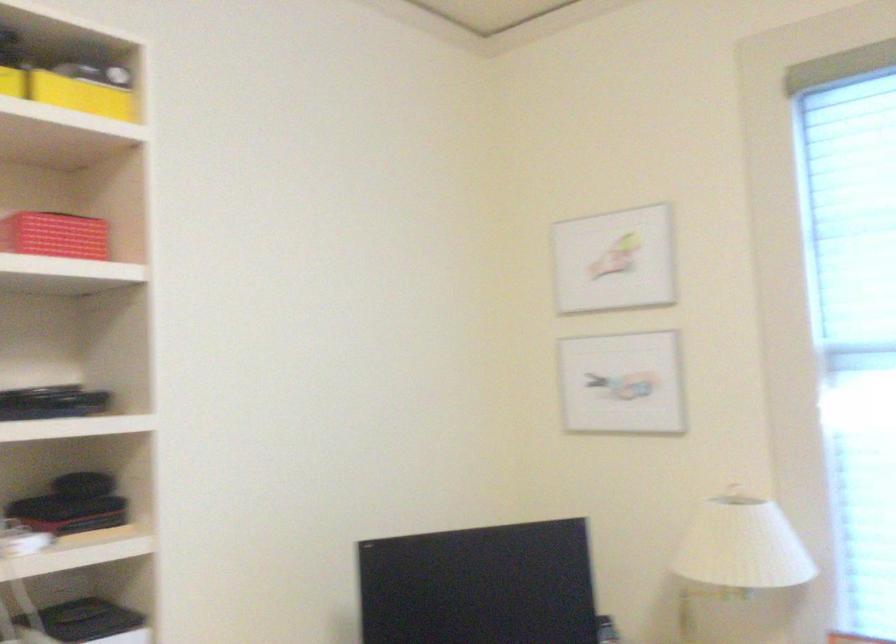
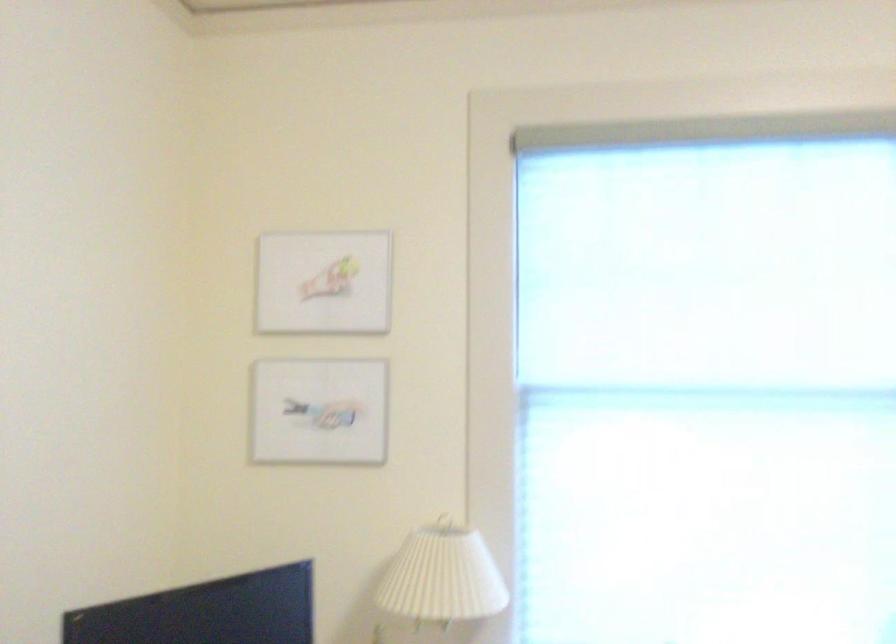
Locate, in the second image, the point that corresponds to the point at 618,383 in the first image.

(319, 412)